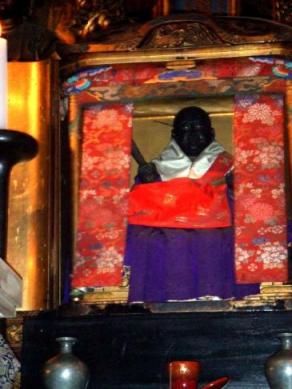
The height and width of the screenshot is (389, 292). Identify the location of purple drape. (177, 257).